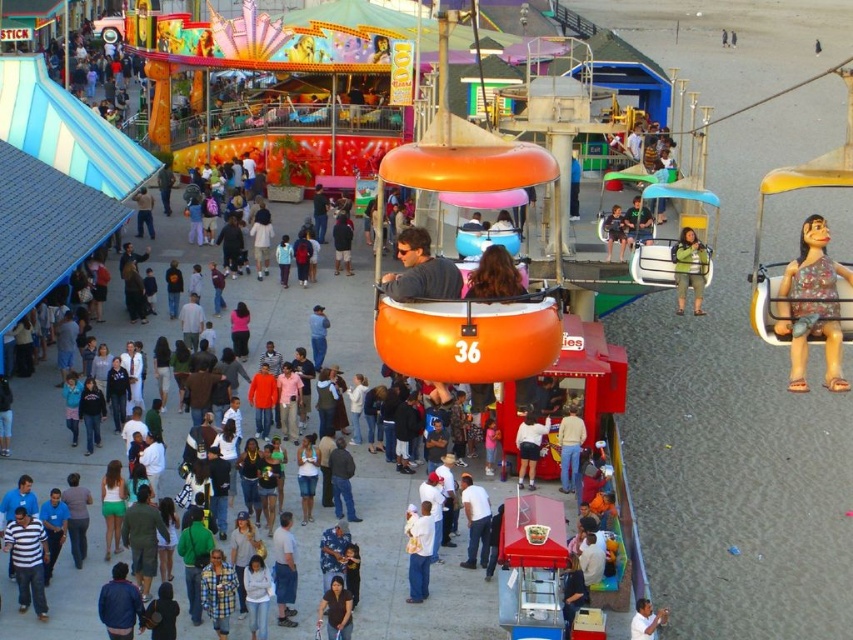
Question: Considering the real-world distances, which object is closest to the matte black shorts at center?

Choices:
 (A) green fabric dress at center
 (B) white cotton shirt at center

Answer: (A)

Question: Is floral fabric doll at right wider than matte gray shirt at center?

Choices:
 (A) yes
 (B) no

Answer: (A)

Question: Among these objects, which one is farthest from the camera?

Choices:
 (A) white cotton shirt at center
 (B) matte black shorts at center
 (C) matte gray shirt at center

Answer: (B)

Question: Can you confirm if denim jacket at center is thinner than matte black shorts at center?

Choices:
 (A) yes
 (B) no

Answer: (A)

Question: Which point is farther to the camera?

Choices:
 (A) matte gray shirt at center
 (B) floral fabric doll at right
 (C) matte black shorts at center

Answer: (C)

Question: Can you confirm if matte gray shirt at center is positioned above matte black shorts at center?

Choices:
 (A) yes
 (B) no

Answer: (A)